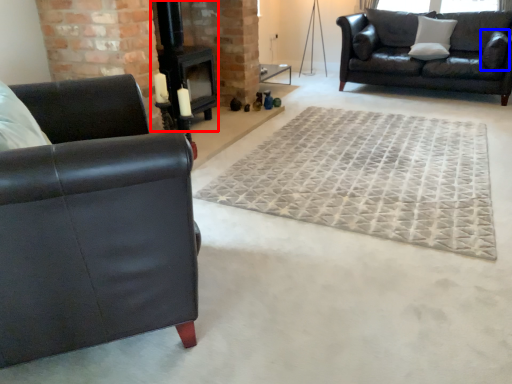
Question: Among these objects, which one is farthest to the camera, fireplace (highlighted by a red box) or pillow (highlighted by a blue box)?

Choices:
 (A) fireplace
 (B) pillow

Answer: (B)